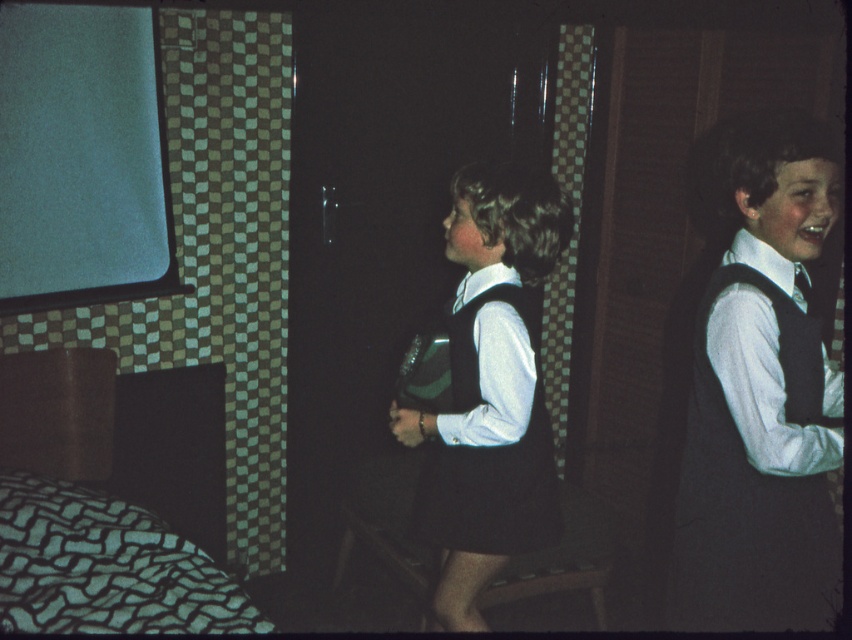
You are a guest in this vintage camper van and want to find a place to sleep. Which object should you choose between the green textured fabric bed at lower left and the white matte dress at center?

The green textured fabric bed at lower left is the appropriate choice for sleeping as it is designed for that purpose, whereas the white matte dress at center is likely an article of clothing and not suitable for sleeping.

You are designing a layout for a childrens book scene where the green textured fabric bed at lower left and the white matte dress at center must be placed in a small room. Based on their sizes, which object should be positioned closer to the wall to save space?

The white matte dress at center should be positioned closer to the wall because the green textured fabric bed at lower left is wider and requires more space, so placing the narrower white matte dress at center near the wall would optimize space usage.

You are standing in front of the vintage trailer camper van interior with two children. There is a point at coordinate (753,268) in the image. Can you determine if this point is closer to the camera than 2 meters?

The point at coordinate (753,268) is 1.71 meters away from the camera, so yes, it is closer than 2 meters.